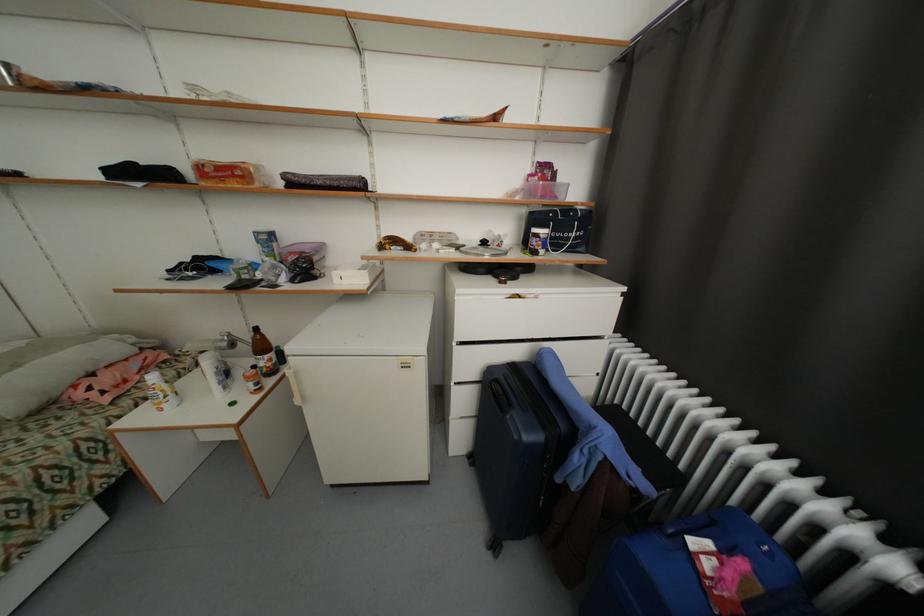
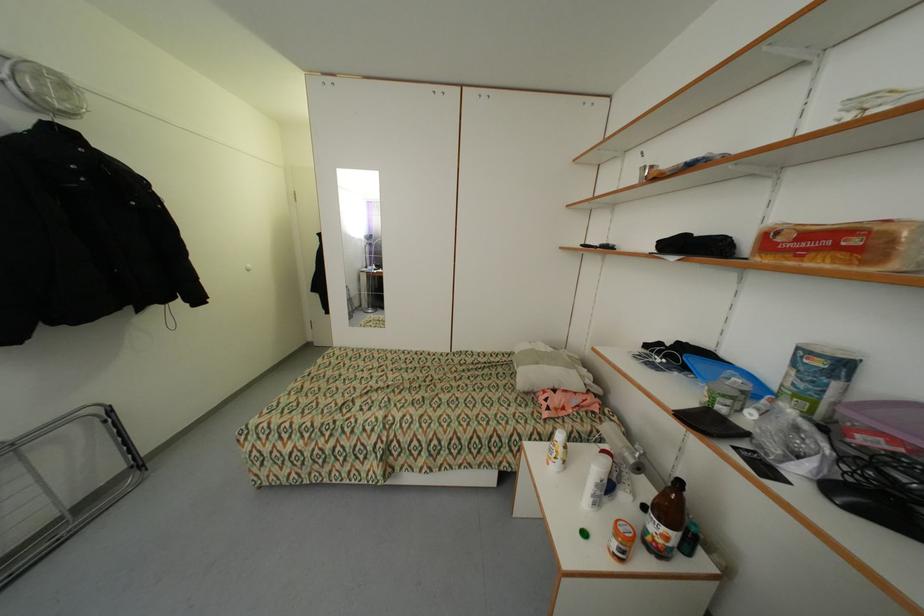
Find the pixel in the second image that matches pixel 232 345 in the first image.

(638, 462)